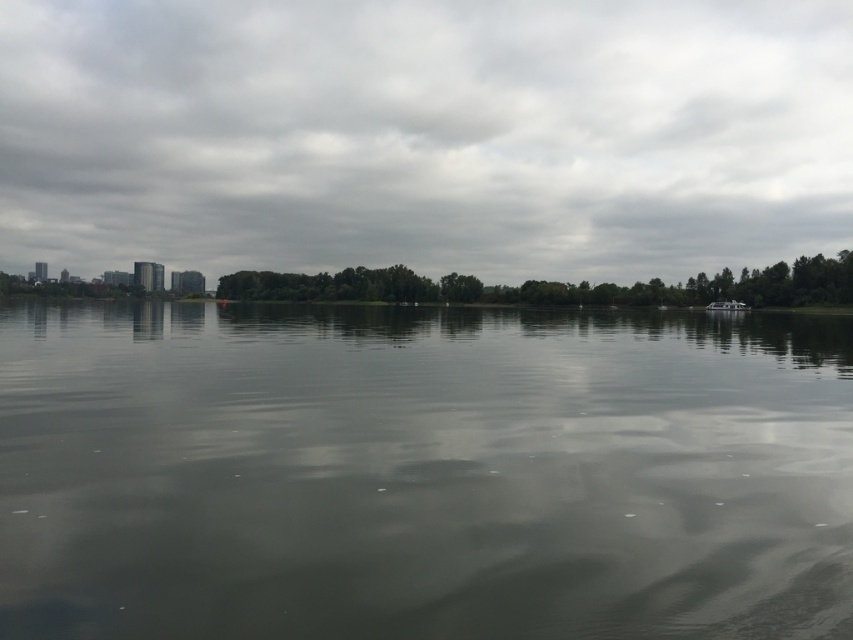
You are standing on a dock and looking at the smooth gray water at center and the cloudy sky at upper center. Which one is lower in height?

The smooth gray water at center has a lesser height compared to cloudy sky at upper center, so the smooth gray water at center is lower in height.

You are a photographer standing at the shoreline aiming to capture the cloudy sky at upper center and the green leafy trees at center in a single shot. Given that your camera has a focal length of 50mm, can you adjust the camera settings to ensure both objects are in focus simultaneously?

The cloudy sky at upper center is 101.61 meters away from the green leafy trees at center. With a 50mm focal length, the depth of field might be sufficient to keep both objects in focus, but it depends on the aperture setting. A smaller aperture like f16 would increase the depth of field, allowing both distant and closer objects to be sharp. However, achieving focus on both might be challenging due to the significant distance between them.